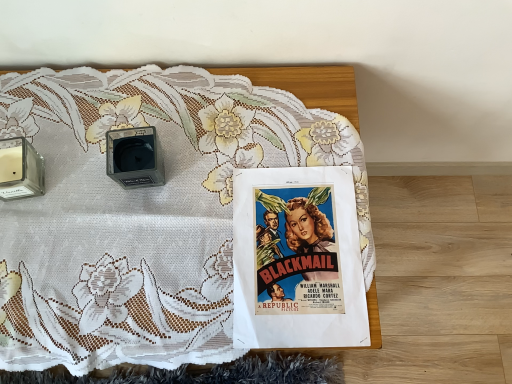
The width and height of the screenshot is (512, 384). What are the coordinates of `vacant space situated on the left part of matte black speaker at center, positioned as the 2th speaker in left-to-right order` in the screenshot? It's located at (59, 163).